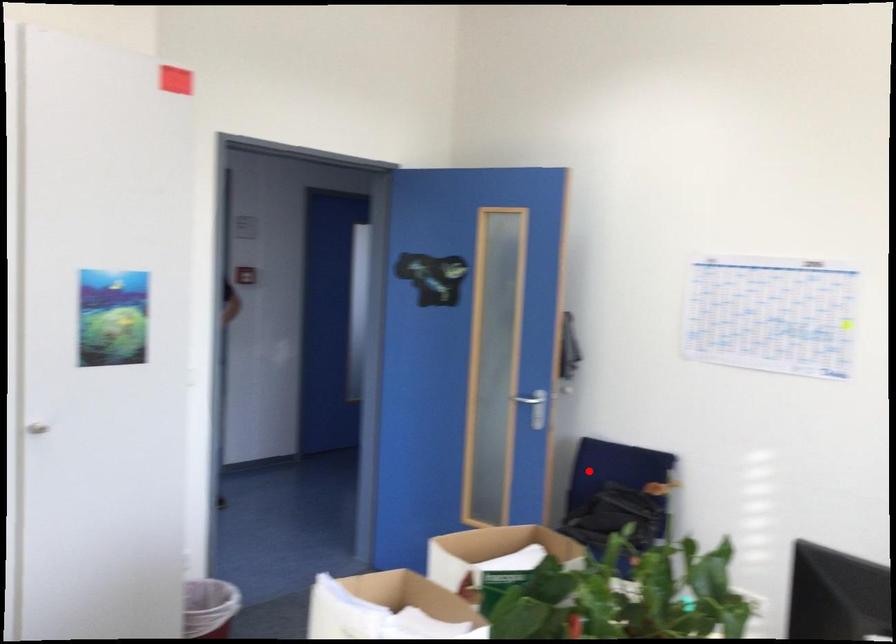
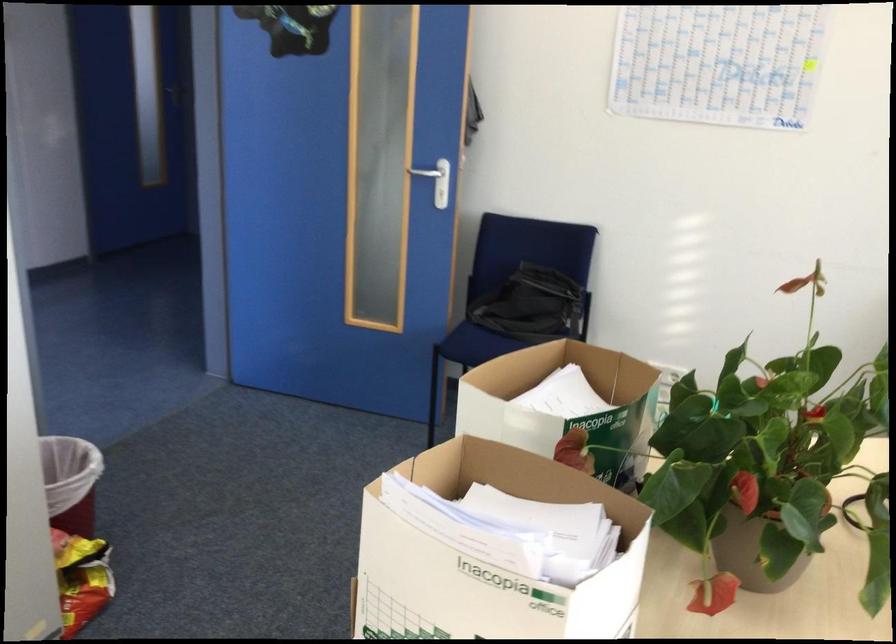
Locate, in the second image, the point that corresponds to the highlighted location in the first image.

(515, 275)